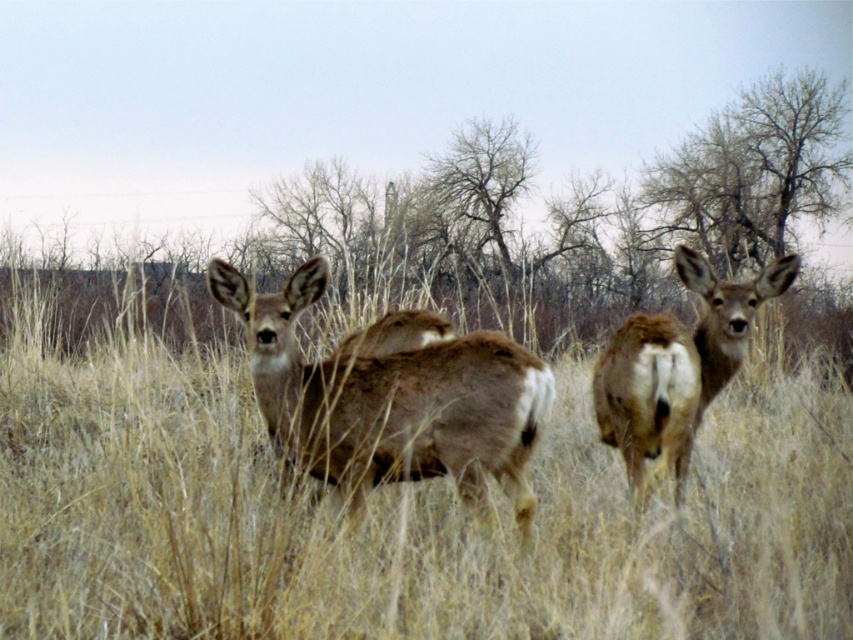
Question: Which point is farther from the camera taking this photo?

Choices:
 (A) (515, 408)
 (B) (640, 369)

Answer: (B)

Question: Is brown textured grass at center in front of brown fur deer at center?

Choices:
 (A) no
 (B) yes

Answer: (A)

Question: Which is nearer to the brown textured grass at center?

Choices:
 (A) brown furry deer at center
 (B) brown fur deer at center

Answer: (A)

Question: Which object is the farthest from the brown textured grass at center?

Choices:
 (A) brown furry deer at center
 (B) brown fur deer at center

Answer: (B)

Question: Is brown fur deer at center positioned before brown furry deer at center?

Choices:
 (A) yes
 (B) no

Answer: (A)

Question: Is brown textured grass at center above brown fur deer at center?

Choices:
 (A) yes
 (B) no

Answer: (B)